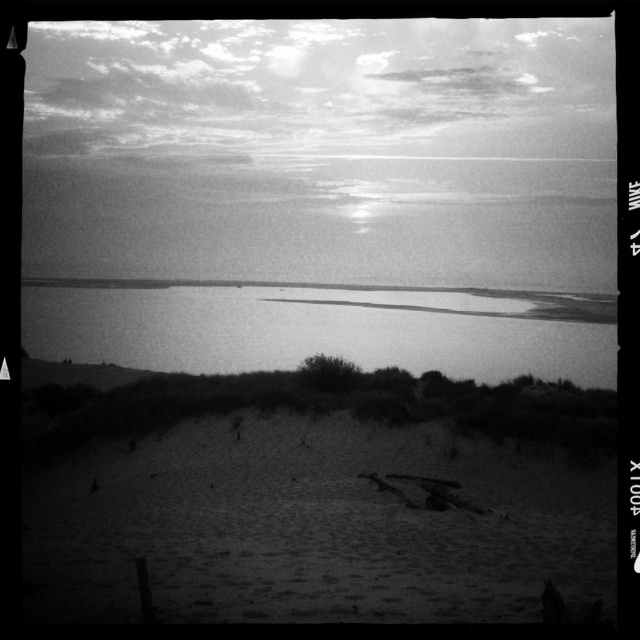
You are standing on the beach and want to walk towards the water. Which direction should you go from the smooth sand at lower center to reach the smooth water at center?

You should walk to the left from the smooth sand at lower center to reach the smooth water at center since the smooth sand at lower center is to the right of the smooth water at center.